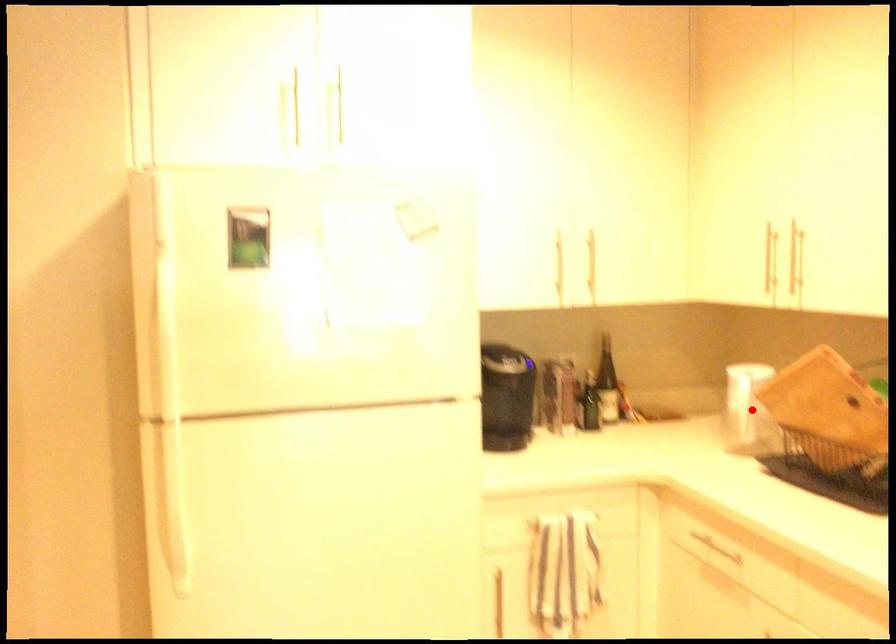
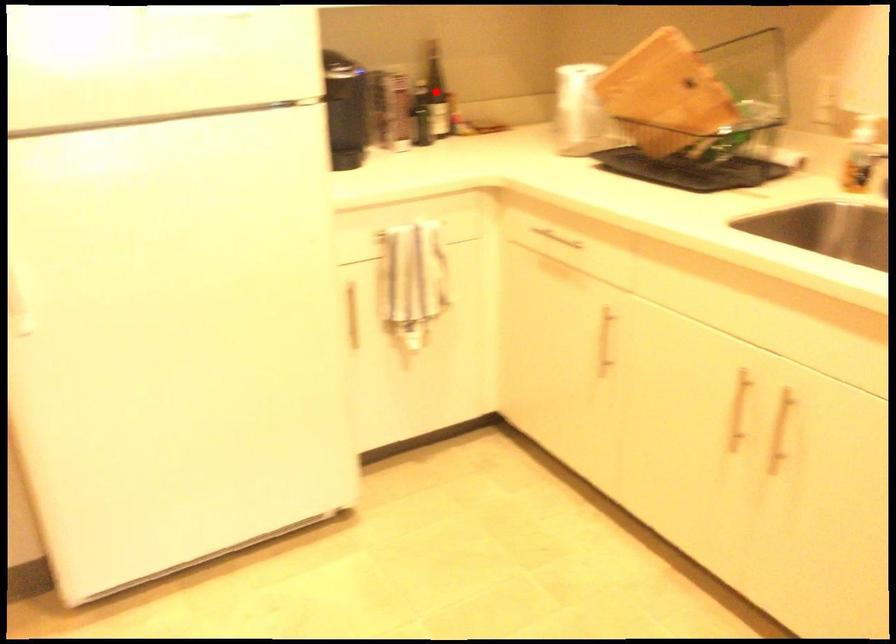
I am providing you with two images of the same scene from different viewpoints. A red point is marked on the first image and another point is marked on the second image. Is the red point in image1 aligned with the point shown in image2?

No